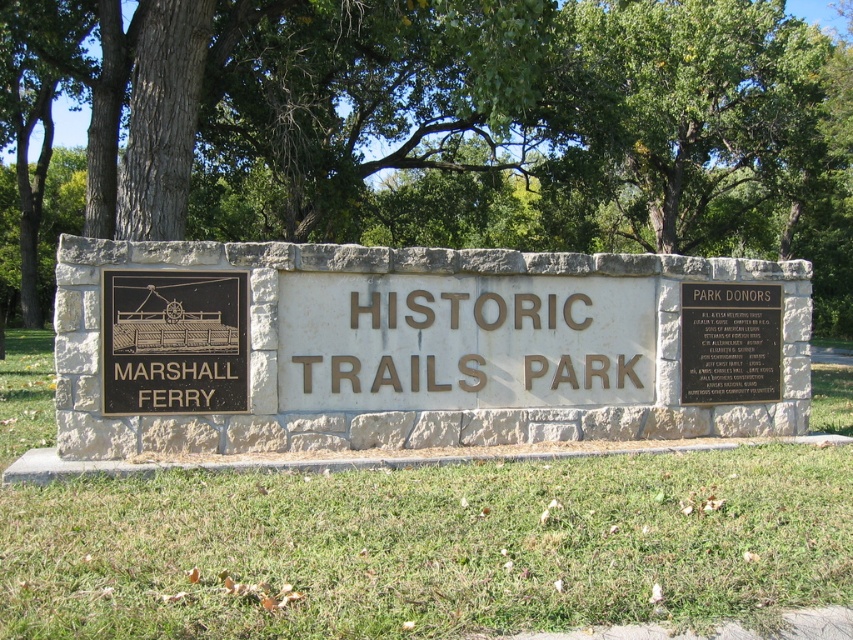
You are standing in front of the stone monument at Historic Trails Park. You need to locate the black polished metal plaque at center. Based on its coordinates, where should you look relative to the main plaque with the park name?

The black polished metal plaque at center is located at coordinates point (173, 340), which is centrally positioned on the monument. Since the main plaque with the park name is at the center, the black polished metal plaque at center is likely positioned at the same central area, possibly overlapping or adjacent to the main plaque depending on the monument layout.

You are a visitor standing at the entrance of Historic Trails Park. You see a green leafy tree at center and a black polished metal plaque at upper right. Which object is closer to you?

The green leafy tree at center is closer to you because it is further to the viewer than the black polished metal plaque at upper right.

You are a park visitor standing in front of the monument. You notice the green leafy tree at center and the black polished metal plaque at upper right. Which object is taller?

The green leafy tree at center is taller than the black polished metal plaque at upper right according to the description.